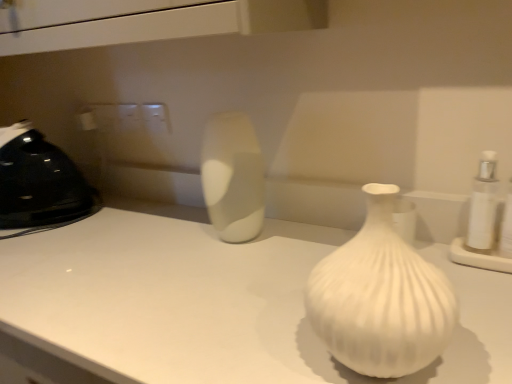
Question: From the image's perspective, is black plastic iron at left positioned above or below white matte counter top at center?

Choices:
 (A) above
 (B) below

Answer: (A)

Question: Which is correct: black plastic iron at left is inside white matte counter top at center, or outside of it?

Choices:
 (A) inside
 (B) outside

Answer: (B)

Question: Which object is the farthest from the white matte counter top at center?

Choices:
 (A) satin white vase at center, the first vase from the back
 (B) black plastic iron at left
 (C) white ribbed vase at center, marked as the 2th vase in a back-to-front arrangement

Answer: (B)

Question: Estimate the real-world distances between objects in this image. Which object is closer to the white ribbed vase at center, marked as the 2th vase in a back-to-front arrangement?

Choices:
 (A) satin white vase at center, the first vase from the back
 (B) black plastic iron at left
 (C) white matte counter top at center

Answer: (C)